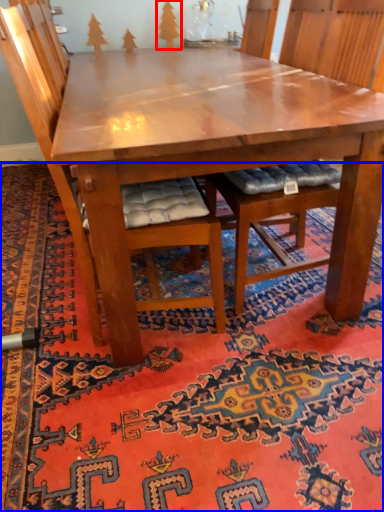
Question: Which object appears closest to the camera in this image, tree (highlighted by a red box) or mat (highlighted by a blue box)?

Choices:
 (A) tree
 (B) mat

Answer: (B)